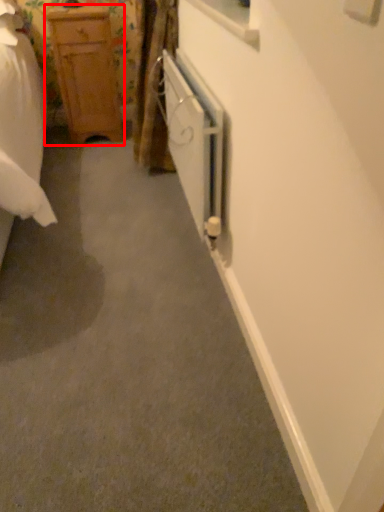
Question: From the image's perspective, considering the relative positions of chest of drawers (annotated by the red box) and screen door in the image provided, where is chest of drawers (annotated by the red box) located with respect to the staircase?

Choices:
 (A) below
 (B) above

Answer: (B)